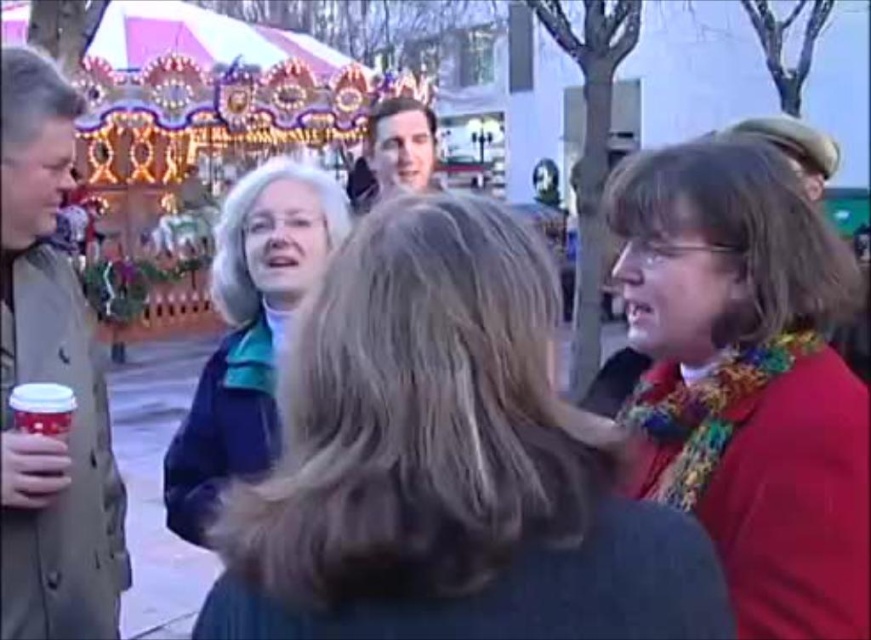
You are at a festive event and see two items, the blue woolen sweater at center and the red matte scarf at right. Which item is located to the left of the other?

The blue woolen sweater at center is positioned on the left side of red matte scarf at right.

You are a photographer trying to capture a candid shot of the blue woolen sweater at center and the red matte scarf at right. Since you want to ensure both are fully visible in the frame, which object should you adjust your camera angle to focus on first to avoid cropping?

The blue woolen sweater at center is not as tall as the red matte scarf at right, so you should focus on the taller red matte scarf at right first to ensure it fits entirely within the frame before adjusting for the shorter blue woolen sweater at center.

You are organizing a photo shoot and need to ensure that both the blue woolen sweater at center and the blue fabric jacket at center are visible in the frame. Based on their sizes, which one should you focus on to ensure both are fully captured?

The blue woolen sweater at center might be wider than blue fabric jacket at center, so focusing on the wider blue woolen sweater at center would ensure both are visible.